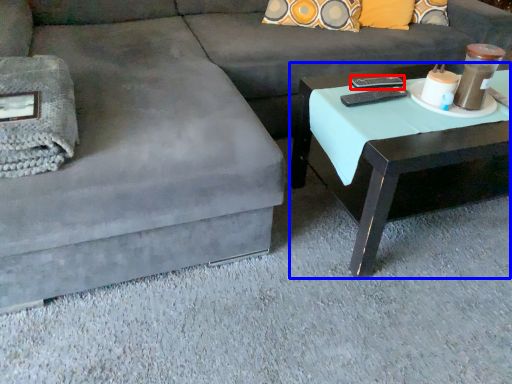
Question: Which of the following is the farthest to the observer, remote (highlighted by a red box) or coffee table (highlighted by a blue box)?

Choices:
 (A) remote
 (B) coffee table

Answer: (A)